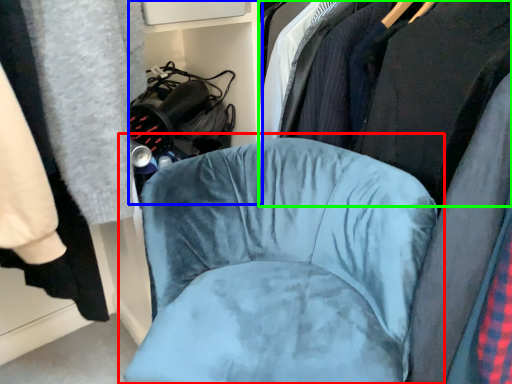
Question: Which object is the farthest from chair (highlighted by a red box)? Choose among these: bookshelf (highlighted by a blue box) or clothing (highlighted by a green box).

Choices:
 (A) bookshelf
 (B) clothing

Answer: (A)